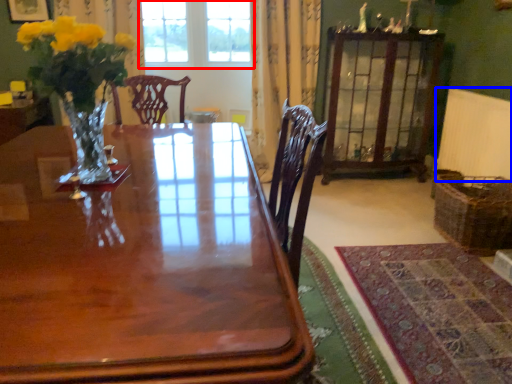
Question: Which object is closer to the camera taking this photo, window (highlighted by a red box) or radiator (highlighted by a blue box)?

Choices:
 (A) window
 (B) radiator

Answer: (B)